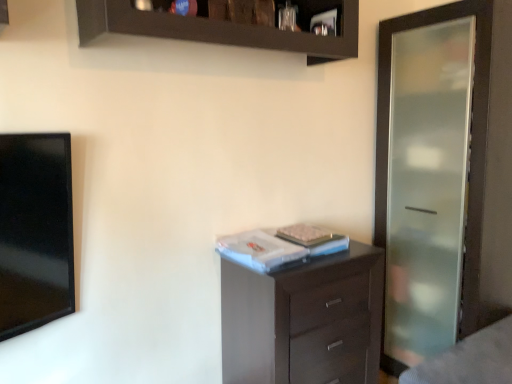
Question: From the image's perspective, is white matte book at center above or below dark wood chest of drawers at center?

Choices:
 (A) below
 (B) above

Answer: (B)

Question: From a real-world perspective, is white matte book at center physically located above or below dark wood chest of drawers at center?

Choices:
 (A) below
 (B) above

Answer: (B)

Question: Considering the real-world distances, which object is closest to the white matte book at center?

Choices:
 (A) dark wood chest of drawers at center
 (B) frosted glass screen door at right
 (C) dark wood shelf at upper center

Answer: (A)

Question: Which object is the farthest from the dark wood shelf at upper center?

Choices:
 (A) white matte book at center
 (B) dark wood chest of drawers at center
 (C) frosted glass screen door at right

Answer: (B)